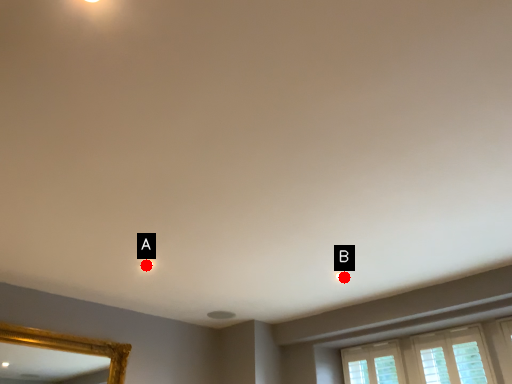
Question: Two points are circled on the image, labeled by A and B beside each circle. Which of the following is the closest to the observer?

Choices:
 (A) A is closer
 (B) B is closer

Answer: (A)